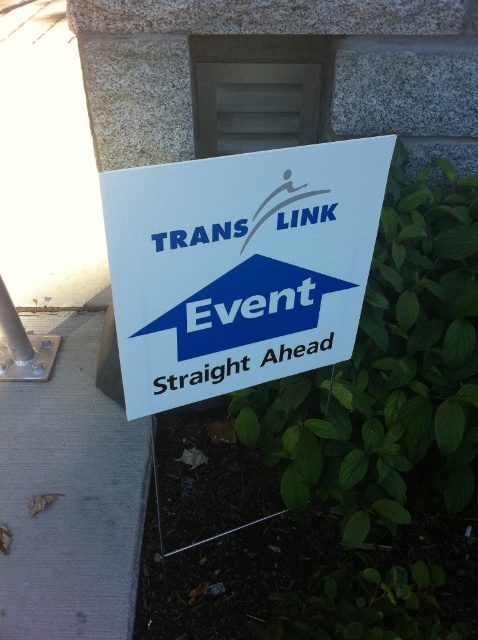
Is gray concrete pavement at lower left shorter than blue paper sign at center?

No, gray concrete pavement at lower left is not shorter than blue paper sign at center.

Who is higher up, gray concrete pavement at lower left or blue paper sign at center?

Positioned higher is blue paper sign at center.

Which is behind, point (54, 429) or point (216, 308)?

Point (54, 429)

I want to click on gray concrete pavement at lower left, so (69, 497).

Does white paper sign at center appear on the right side of blue paper sign at center?

Yes, white paper sign at center is to the right of blue paper sign at center.

Who is higher up, white paper sign at center or blue paper sign at center?

white paper sign at center is above.

Which is in front, point (340, 173) or point (217, 284)?

Point (340, 173) is in front.

This screenshot has height=640, width=478. In order to click on white paper sign at center in this screenshot , I will do `click(238, 268)`.

Which of these two, white paper sign at center or gray concrete pavement at lower left, stands taller?

gray concrete pavement at lower left is taller.

Which is below, white paper sign at center or gray concrete pavement at lower left?

gray concrete pavement at lower left is lower down.

Does point (213, 385) lie behind point (91, 422)?

No, (213, 385) is in front of (91, 422).

Locate an element on the screen. This screenshot has width=478, height=640. white paper sign at center is located at coordinates (238, 268).